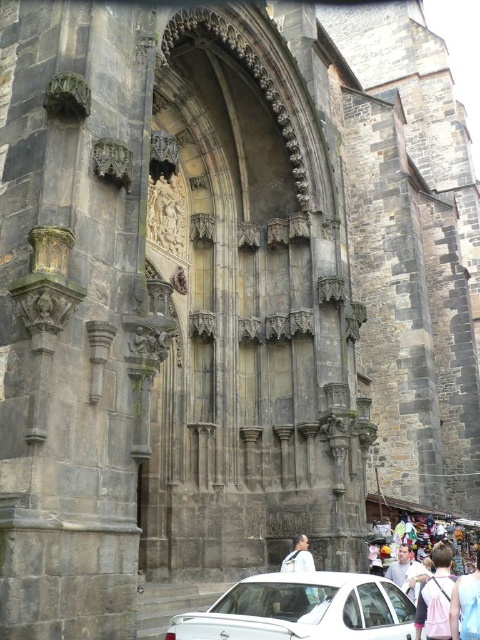
Question: Which object appears farthest from the camera in this image?

Choices:
 (A) pink fabric at center
 (B) white matte shirt at center

Answer: (A)

Question: Is pink fabric at center thinner than light pink fabric at lower right?

Choices:
 (A) no
 (B) yes

Answer: (B)

Question: Among these points, which one is nearest to the camera?

Choices:
 (A) (314, 589)
 (B) (435, 580)
 (C) (452, 632)

Answer: (C)

Question: Is pink fabric at center closer to the viewer compared to light pink fabric at lower right?

Choices:
 (A) no
 (B) yes

Answer: (A)

Question: Can you confirm if white glossy car at lower center is wider than white matte shirt at center?

Choices:
 (A) no
 (B) yes

Answer: (B)

Question: Which point is farther from the camera taking this photo?

Choices:
 (A) (288, 564)
 (B) (360, 621)
 (C) (432, 604)
 (D) (458, 589)

Answer: (A)